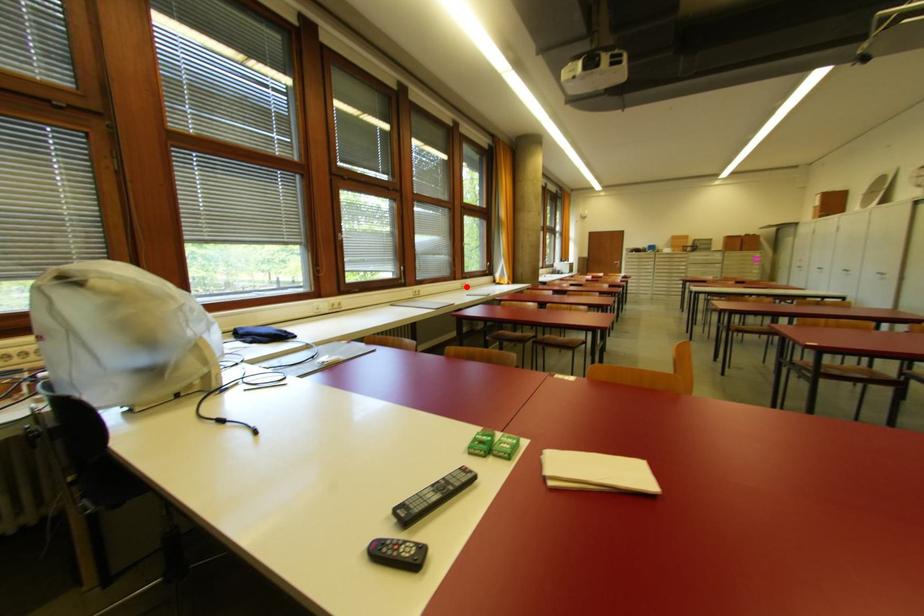
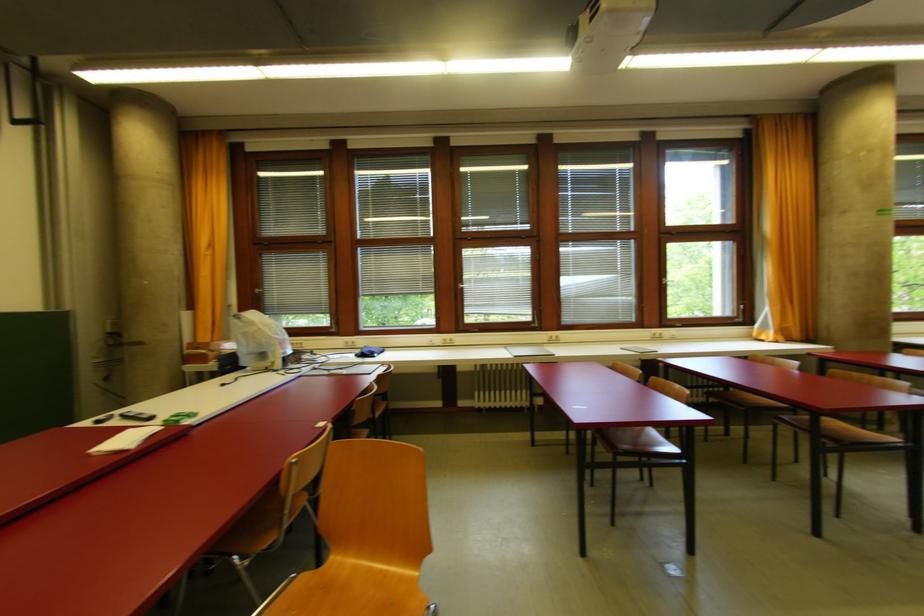
Question: I am providing you with two images of the same scene from different viewpoints. A red point is marked on the first image. Can you still see the location of the red point in image 2?

Choices:
 (A) Yes
 (B) No

Answer: (A)